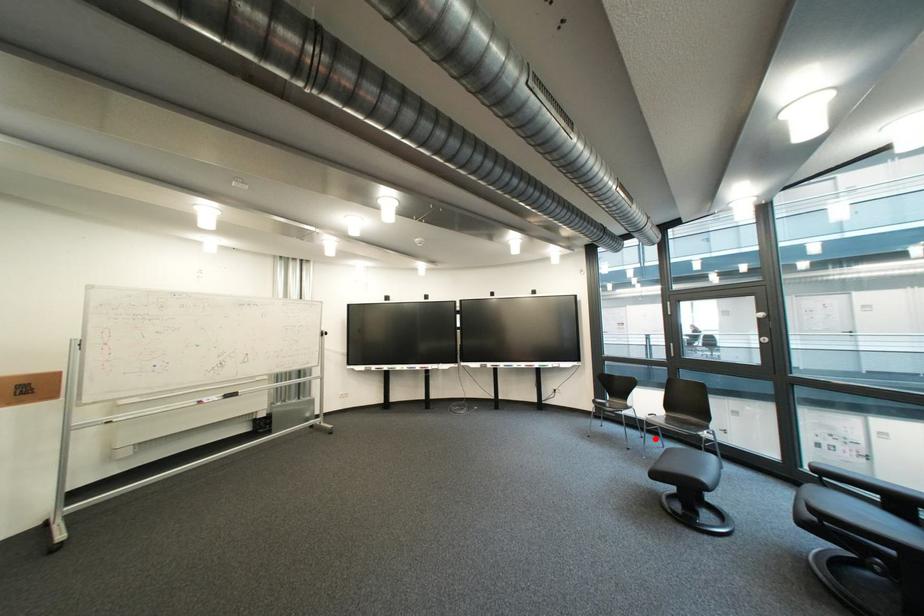
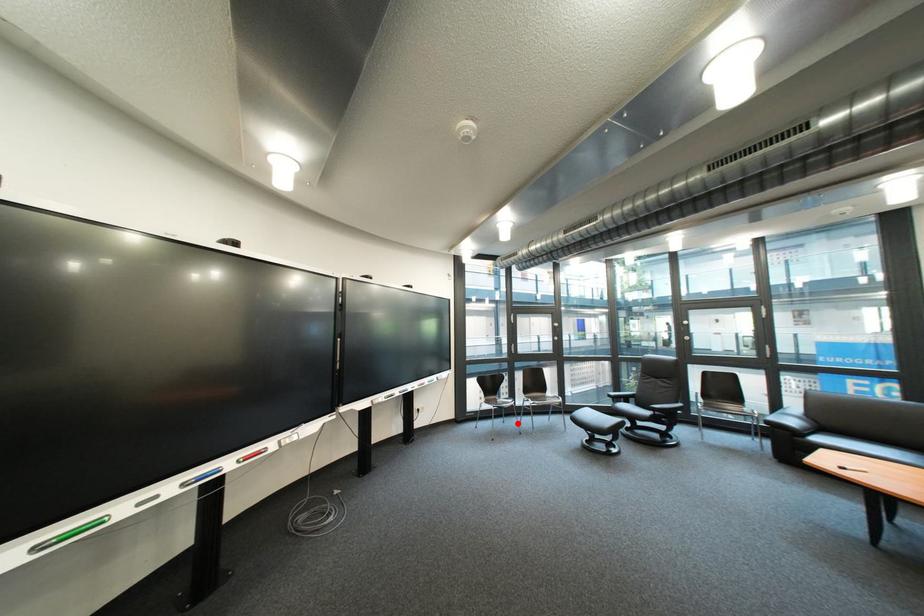
I am providing you with two images of the same scene from different viewpoints. A red point is marked on the first image and another point is marked on the second image. Is the marked point in image1 the same physical position as the marked point in image2?

Yes